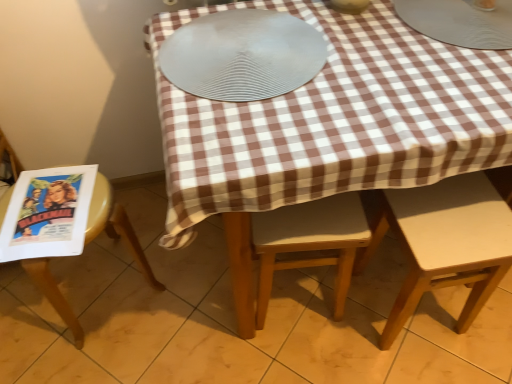
The image size is (512, 384). What are the coordinates of `free space in front of yellow plastic chair at left, marked as the 3th chair in a right-to-left arrangement` in the screenshot? It's located at (87, 357).